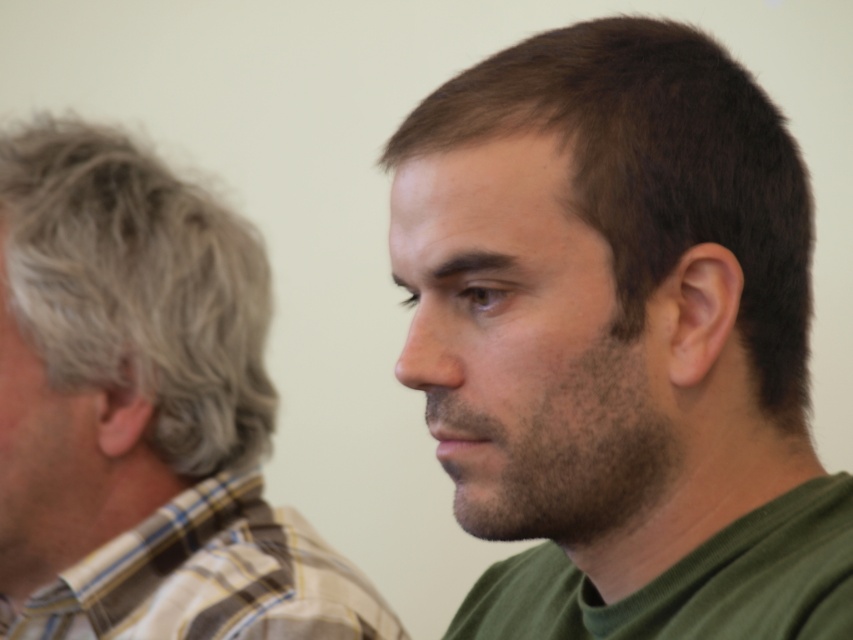
Question: Where is plaid shirt at left located in relation to plaid fabric shirt at left in the image?

Choices:
 (A) left
 (B) right

Answer: (A)

Question: Does plaid shirt at left have a lesser width compared to plaid fabric shirt at left?

Choices:
 (A) no
 (B) yes

Answer: (B)

Question: Which point is closer to the camera?

Choices:
 (A) (320, 538)
 (B) (99, 342)
 (C) (770, 163)

Answer: (C)

Question: Which object is positioned farthest from the dark brown hair at right?

Choices:
 (A) plaid shirt at left
 (B) plaid fabric shirt at left

Answer: (A)

Question: Which point appears farthest from the camera in this image?

Choices:
 (A) (157, 273)
 (B) (746, 636)
 (C) (320, 548)

Answer: (C)

Question: Does dark brown hair at right have a greater width compared to plaid fabric shirt at left?

Choices:
 (A) no
 (B) yes

Answer: (A)